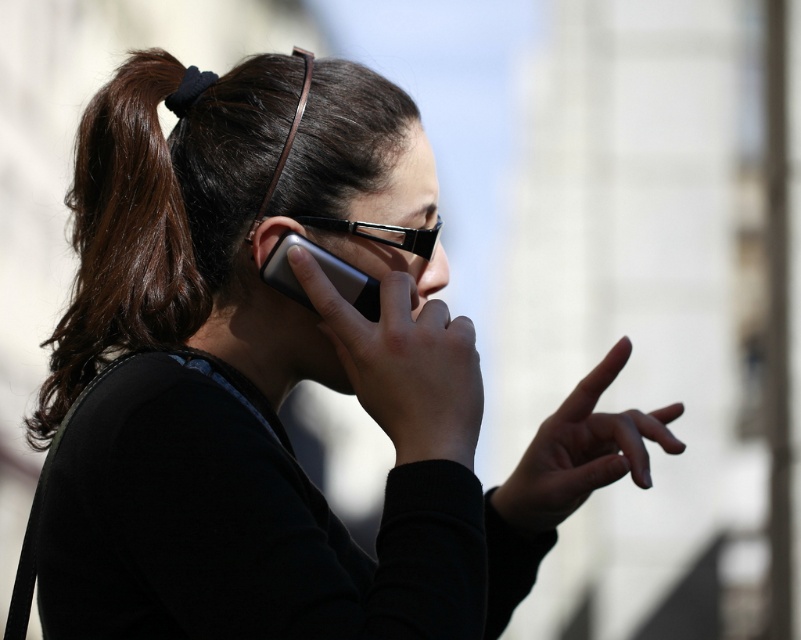
Question: Which point is farther to the camera?

Choices:
 (A) (419, 237)
 (B) (377, 365)
 (C) (264, 252)

Answer: (A)

Question: Can you confirm if brown shiny hair at upper left is positioned below silver metallic phone at center?

Choices:
 (A) no
 (B) yes

Answer: (A)

Question: Which of these objects is positioned closest to the matte black phone at center?

Choices:
 (A) black plastic glasses at center
 (B) smooth skin hand at center
 (C) brown shiny hair at center
 (D) matte black ear at center

Answer: (D)

Question: Does brown shiny hair at center appear under brown shiny hair at upper left?

Choices:
 (A) yes
 (B) no

Answer: (B)

Question: Can you confirm if brown shiny hair at center is smaller than smooth skin hand at center?

Choices:
 (A) yes
 (B) no

Answer: (B)

Question: Which object is the farthest from the matte black phone at center?

Choices:
 (A) brown shiny hair at center
 (B) silver metallic phone at center
 (C) matte black ear at center

Answer: (A)